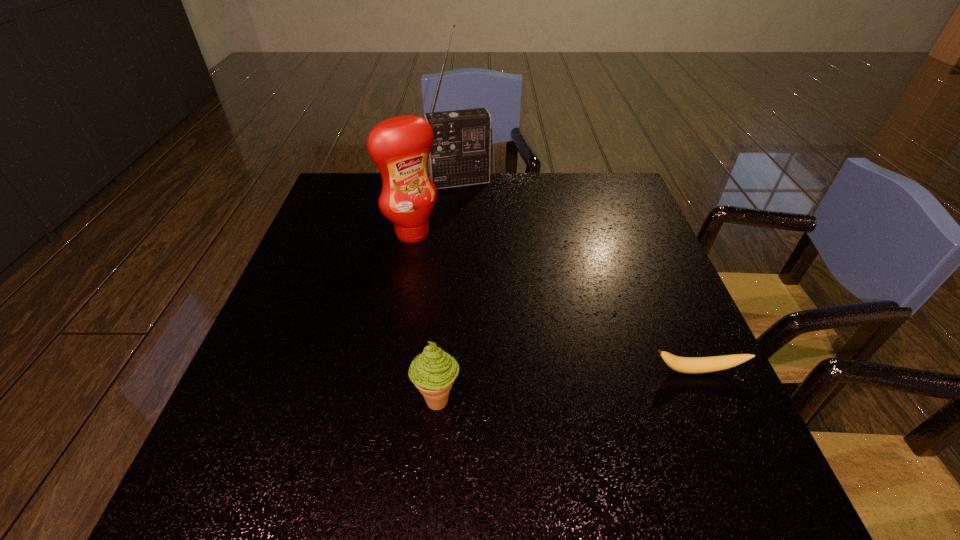
Where is `icecream`? icecream is located at coordinates (433, 371).

Find the location of `the second shortest object`. the second shortest object is located at coordinates (433, 371).

What are the coordinates of `the rightmost object` in the screenshot? It's located at (691, 365).

Find the location of a particular element. This screenshot has width=960, height=540. the second nearest object is located at coordinates (691, 365).

The image size is (960, 540). In order to click on the second farthest object in this screenshot , I will do `click(400, 146)`.

At what (x,y) coordinates should I click in order to perform the action: click on the third shortest object. Please return your answer as a coordinate pair (x, y). The width and height of the screenshot is (960, 540). Looking at the image, I should click on (400, 146).

Find the location of `radio receiver`. radio receiver is located at coordinates (462, 146).

Find the location of a particular element. the farthest object is located at coordinates (462, 146).

This screenshot has width=960, height=540. What are the coordinates of `vacant region located on the back of the third tallest object` in the screenshot? It's located at (444, 313).

Locate an element on the screen. free space located 0.110m on the upward curve of the rightmost object is located at coordinates (723, 429).